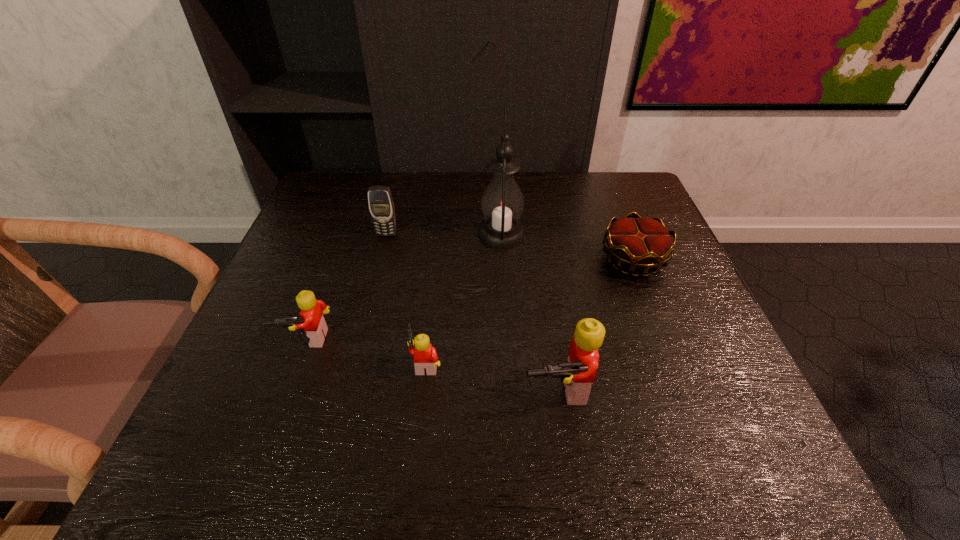
This screenshot has width=960, height=540. I want to click on vacant space at the far edge of the desktop, so click(477, 195).

Identify the location of free location at the near edge of the desktop. (462, 389).

In order to click on vacant space at the left edge in this screenshot , I will do `click(314, 295)`.

This screenshot has width=960, height=540. Find the location of `free space at the right edge of the desktop`. free space at the right edge of the desktop is located at coordinates (660, 285).

Locate an element on the screen. vacant space at the far right corner of the desktop is located at coordinates (627, 181).

This screenshot has width=960, height=540. Identify the location of free spot between the leftmost Lego and the tallest object. (404, 286).

Find the location of `vacant area that lies between the second shortest Lego and the oil lamp`. vacant area that lies between the second shortest Lego and the oil lamp is located at coordinates point(404,286).

Locate an element on the screen. This screenshot has height=540, width=960. vacant point located between the cellular telephone and the oil lamp is located at coordinates (444, 234).

Where is `unoccupied area between the second object from left to right and the shortest Lego`? This screenshot has width=960, height=540. unoccupied area between the second object from left to right and the shortest Lego is located at coordinates (406, 299).

Identify the location of vacant point located between the fifth object from right to left and the rightmost Lego. Image resolution: width=960 pixels, height=540 pixels. (472, 312).